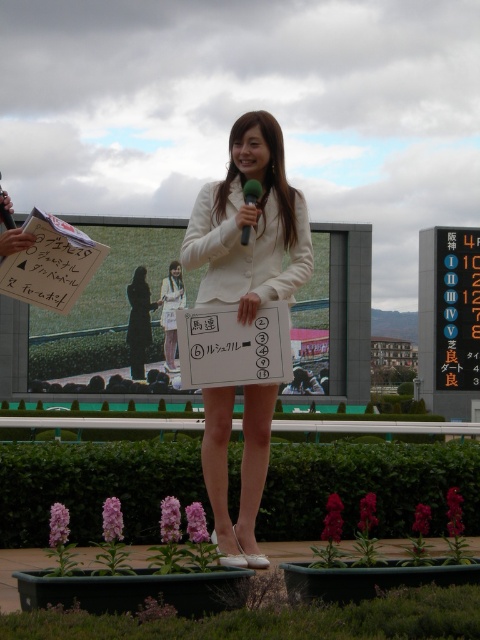
Between white paper at center and black plastic sign at center right, which one has less height?

white paper at center

Which is more to the right, white paper at center or black plastic sign at center right?

Positioned to the right is black plastic sign at center right.

Find the location of a particular element. white paper at center is located at coordinates tap(233, 346).

Can you confirm if black plastic sign at center right is thinner than white fabric dress at center?

Incorrect, black plastic sign at center right's width is not less than white fabric dress at center's.

Is black plastic sign at center right to the right of white fabric dress at center from the viewer's perspective?

Correct, you'll find black plastic sign at center right to the right of white fabric dress at center.

Is point (476, 300) less distant than point (168, 310)?

No, it is behind (168, 310).

In order to click on black plastic sign at center right in this screenshot , I will do `click(456, 308)`.

Does black matte dress at center appear over metallic silver microphone at center?

No, black matte dress at center is not above metallic silver microphone at center.

The height and width of the screenshot is (640, 480). Describe the element at coordinates (139, 321) in the screenshot. I see `black matte dress at center` at that location.

Measure the distance between point (142,272) and camera.

45.68 meters

The height and width of the screenshot is (640, 480). What are the coordinates of `black matte dress at center` in the screenshot? It's located at (139, 321).